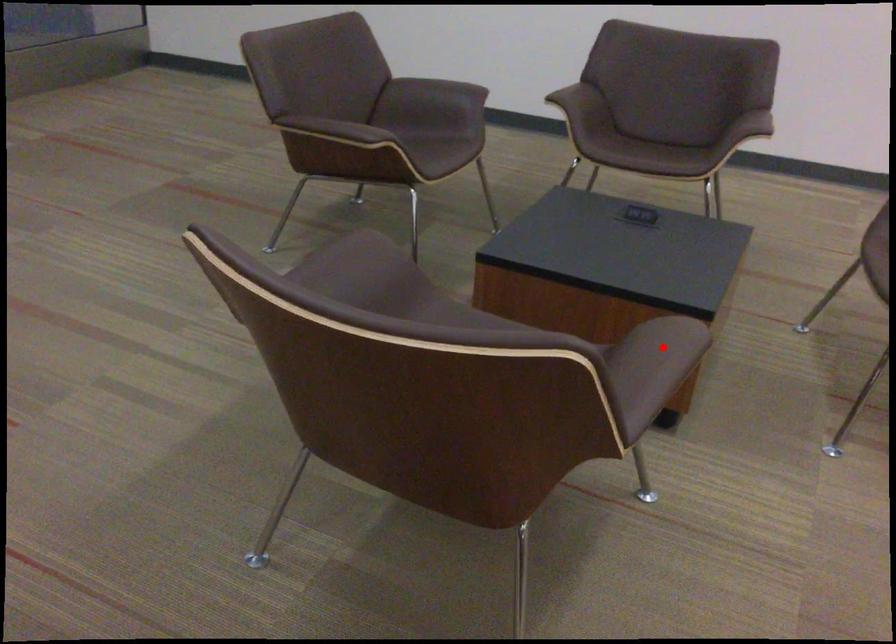
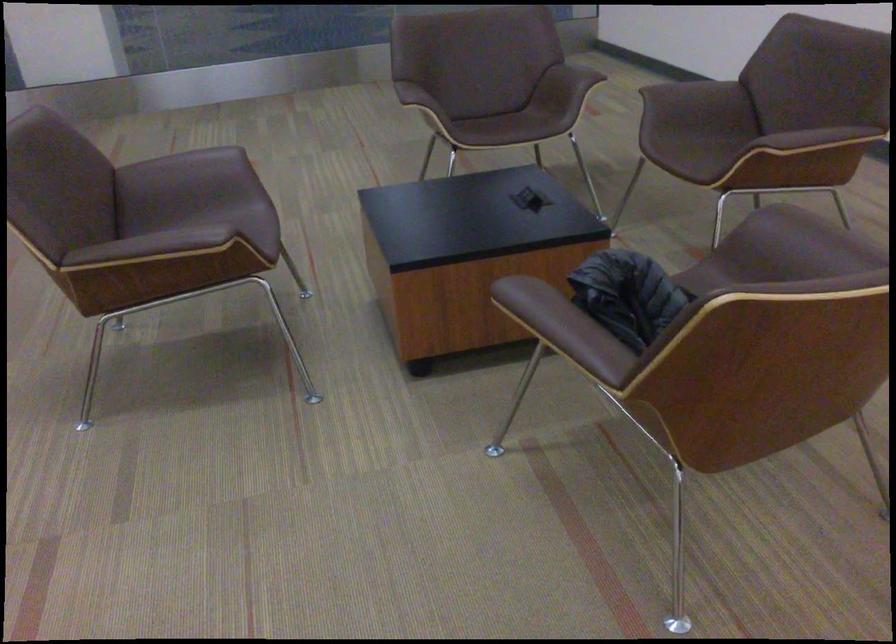
Question: I am providing you with two images of the same scene from different viewpoints. In image1, a red point is highlighted. Considering the same 3D point in image2, which of the following is correct?

Choices:
 (A) It is closer
 (B) It is farther

Answer: (B)